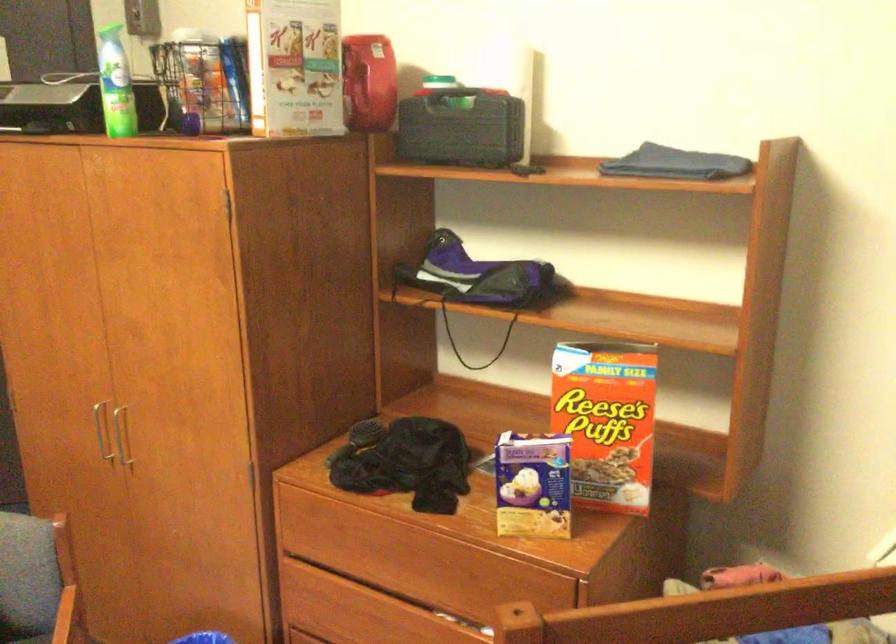
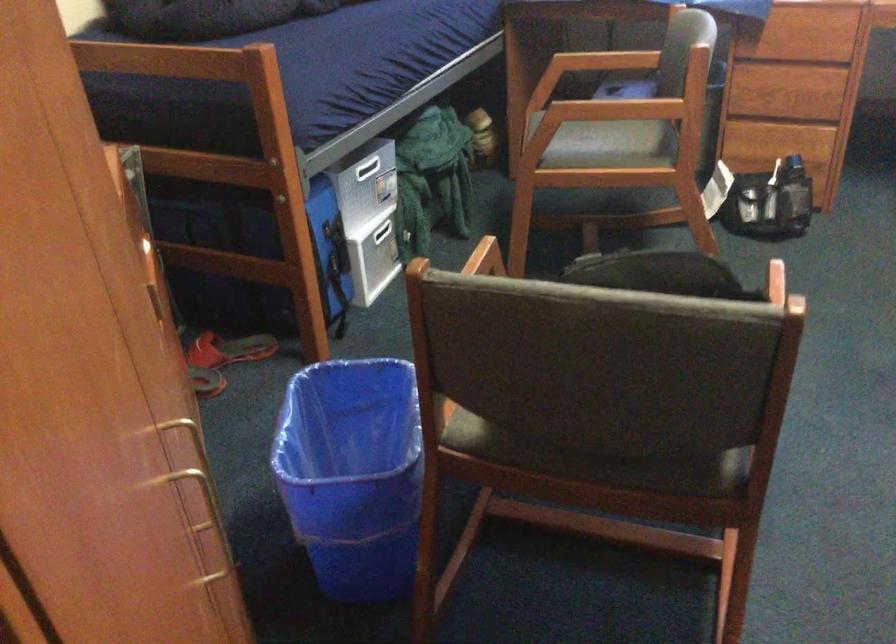
The point at (83,431) is marked in the first image. Where is the corresponding point in the second image?

(188, 419)